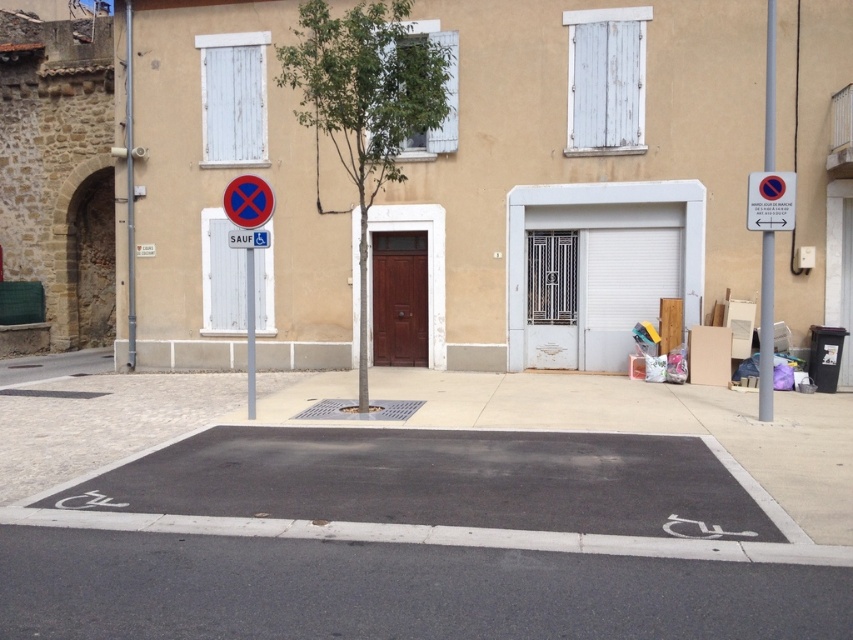
Question: Is metallic signpost at right above metallic pole at left?

Choices:
 (A) no
 (B) yes

Answer: (A)

Question: Can you confirm if metallic pole at left is smaller than red plastic sign at center?

Choices:
 (A) no
 (B) yes

Answer: (A)

Question: Which object appears closest to the camera in this image?

Choices:
 (A) metallic pole at center
 (B) metallic pole at left
 (C) metallic signpost at right
 (D) red plastic sign at center

Answer: (A)

Question: Does metallic signpost at right have a larger size compared to blue plastic circle at upper center?

Choices:
 (A) no
 (B) yes

Answer: (A)

Question: Which point is farther to the camera?

Choices:
 (A) (262, 243)
 (B) (250, 406)
 (C) (132, 92)
 (D) (772, 26)

Answer: (C)

Question: Which object appears farthest from the camera in this image?

Choices:
 (A) metallic pole at center
 (B) white matte garage door at center
 (C) red plastic sign at center
 (D) metallic signpost at right

Answer: (B)